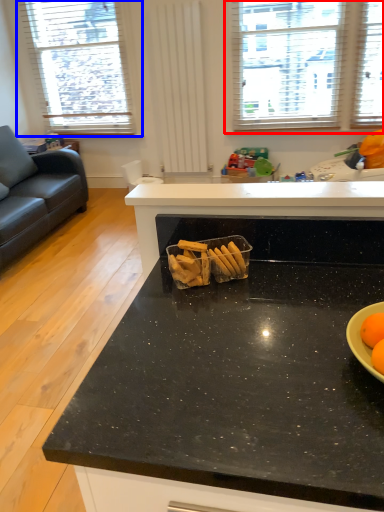
Question: Which object appears farthest to the camera in this image, window (highlighted by a red box) or window (highlighted by a blue box)?

Choices:
 (A) window
 (B) window

Answer: (B)